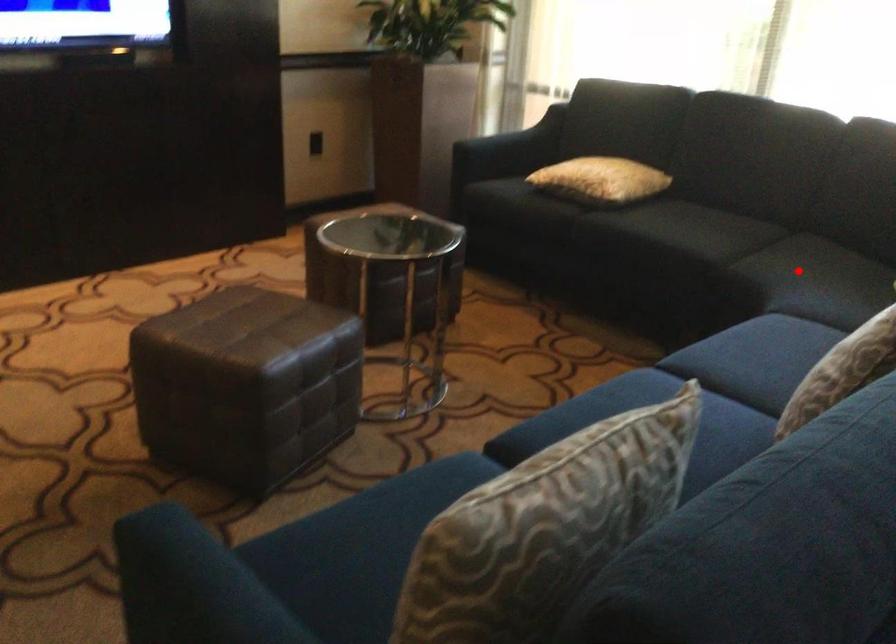
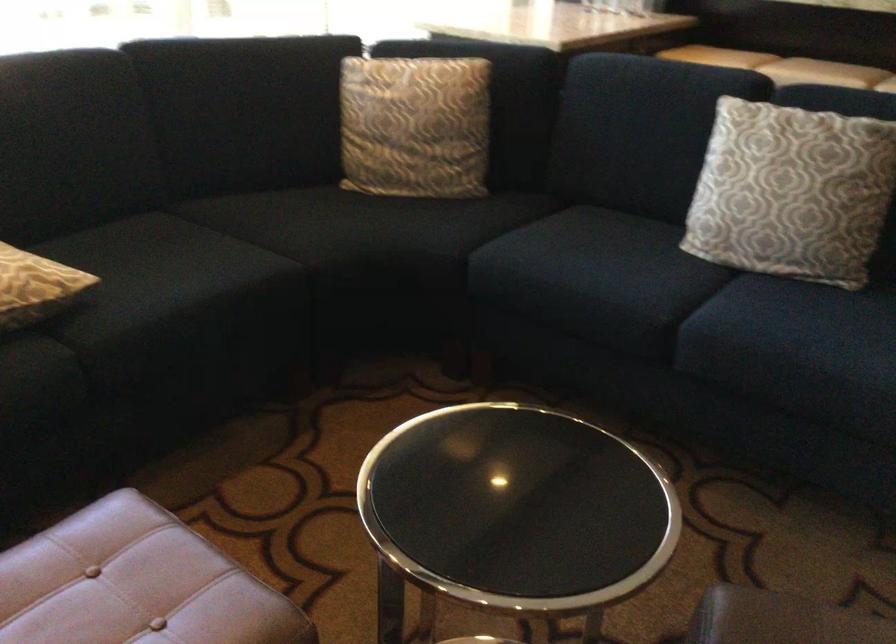
Question: A red point is marked in image1. In image2, is the corresponding 3D point closer to the camera or farther? Reply with the corresponding letter.

Choices:
 (A) The corresponding 3D point is closer.
 (B) The corresponding 3D point is farther.

Answer: (A)